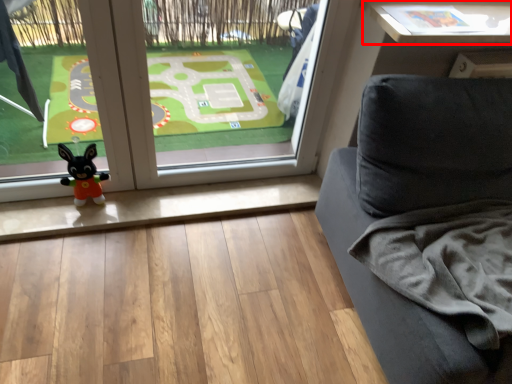
Question: Considering the relative positions of table (annotated by the red box) and window in the image provided, where is table (annotated by the red box) located with respect to the staircase?

Choices:
 (A) left
 (B) right

Answer: (B)